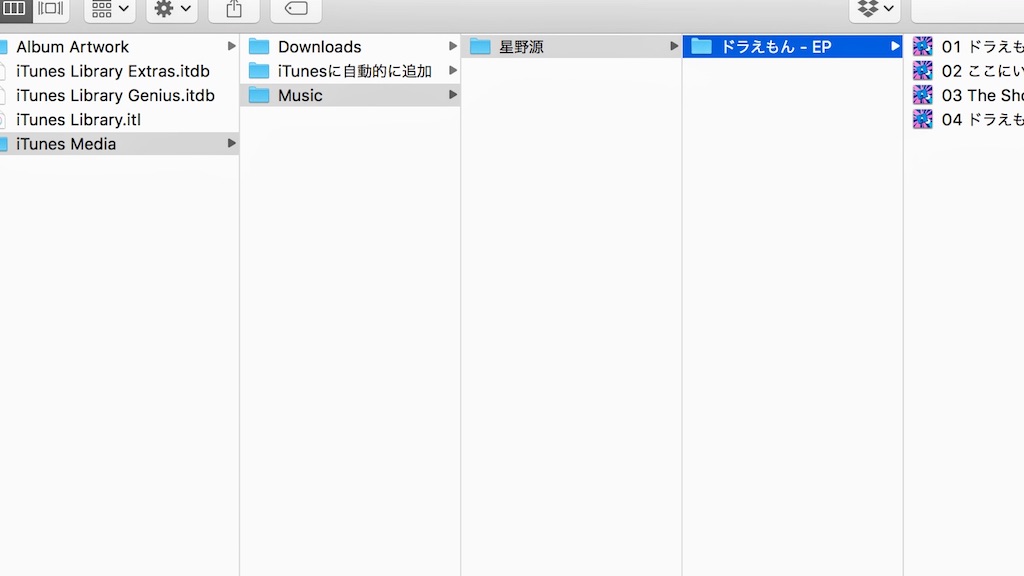
At what (x,y) coordinates should I click in order to perform the action: click on files. Please return your answer as a coordinate pair (x, y). Looking at the image, I should click on (931, 123), (941, 89), (950, 70), (946, 47), (136, 70), (116, 98), (116, 112).